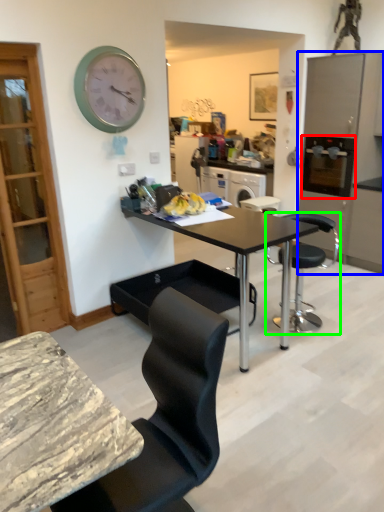
Question: Which is nearer to the appliance (highlighted by a red box)? cabinetry (highlighted by a blue box) or chair (highlighted by a green box).

Choices:
 (A) cabinetry
 (B) chair

Answer: (A)